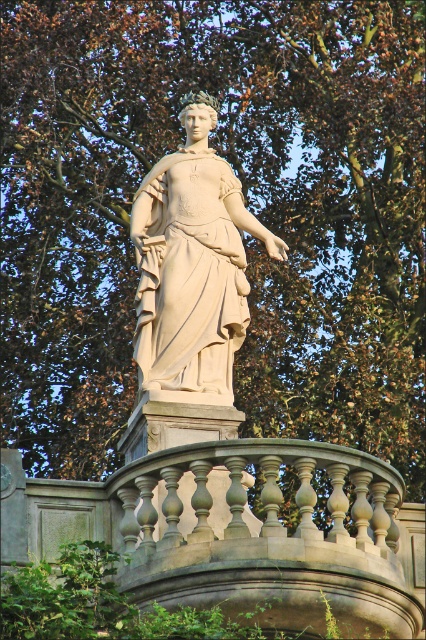
Question: Does gray stone balustrade at center appear on the right side of beige stone statue at center?

Choices:
 (A) no
 (B) yes

Answer: (B)

Question: Which point is closer to the camera taking this photo?

Choices:
 (A) (212, 232)
 (B) (135, 480)

Answer: (B)

Question: Which point appears farthest from the camera in this image?

Choices:
 (A) (193, 204)
 (B) (308, 480)

Answer: (A)

Question: Is gray stone balustrade at center smaller than beige stone statue at center?

Choices:
 (A) no
 (B) yes

Answer: (A)

Question: Is gray stone balustrade at center behind beige stone statue at center?

Choices:
 (A) no
 (B) yes

Answer: (A)